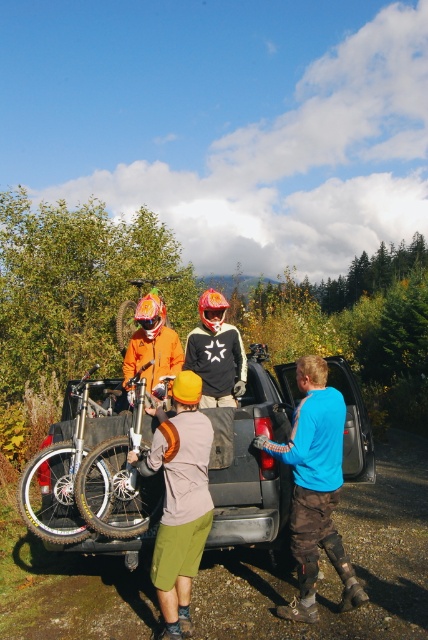
You are standing at the origin point in the image. The metallic silver truck at center is located at coordinates point (89, 490). If you want to move towards the metallic silver truck at center, in which direction should you move?

The point (89, 490) indicates the location of the metallic silver truck at center, so moving towards that coordinate would mean heading directly toward the metallic silver truck at center.

What is the color of the fabric at the point with coordinates (x=315, y=486)?

The point at coordinates (x=315, y=486) is on blue fabric truck at center.

You are planning to load a metallic silver truck at center with an orange matte bicycle at center. Given the truck and bicycle dimensions, will the bicycle fit inside the truck bed without any modifications?

The metallic silver truck at center is narrower than the orange matte bicycle at center, so the bicycle will not fit inside the truck bed without modifications.